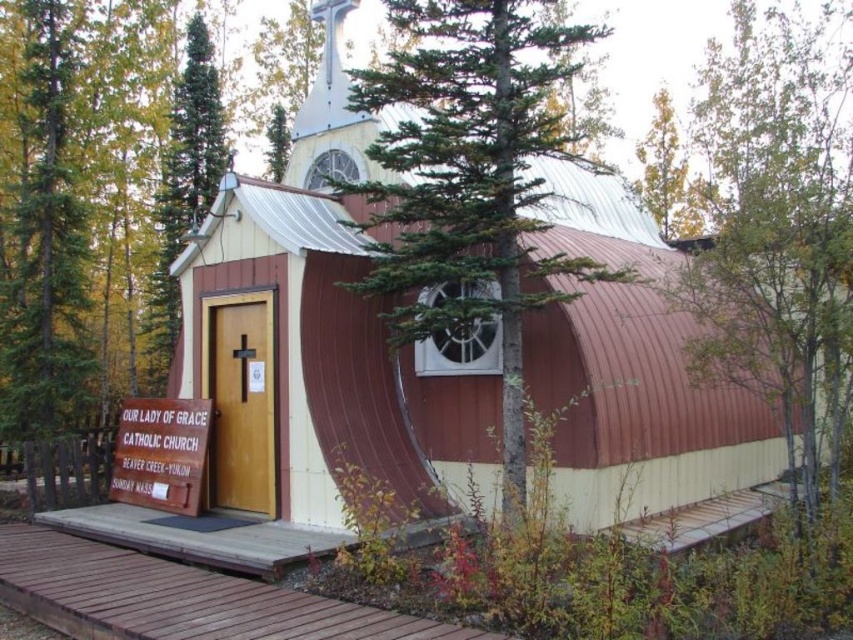
Question: Does brown wooden walkway at lower center lie in front of green textured pine tree at upper center?

Choices:
 (A) yes
 (B) no

Answer: (A)

Question: Is brown wooden walkway at lower center to the left of green coniferous tree at upper left from the viewer's perspective?

Choices:
 (A) yes
 (B) no

Answer: (B)

Question: Among these points, which one is farthest from the camera?

Choices:
 (A) (167, 579)
 (B) (148, 438)
 (C) (822, 291)
 (D) (189, 140)

Answer: (D)

Question: Can you confirm if green leafy tree at center is positioned to the right of white wooden sign at center?

Choices:
 (A) yes
 (B) no

Answer: (A)

Question: Based on their relative distances, which object is nearer to the green leafy tree at center?

Choices:
 (A) green coniferous tree at upper left
 (B) brown wooden walkway at lower center
 (C) green textured pine tree at upper center
 (D) white wooden sign at center

Answer: (B)

Question: Which object is closer to the camera taking this photo?

Choices:
 (A) green textured pine tree at upper center
 (B) green leafy tree at center

Answer: (B)